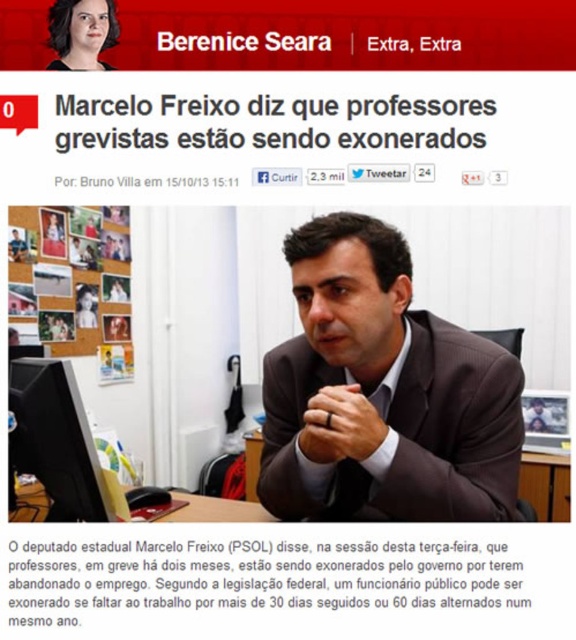
Is brown suit at center further to camera compared to black glossy monitor at lower left?

No, brown suit at center is in front of black glossy monitor at lower left.

What do you see at coordinates (382, 394) in the screenshot?
I see `brown suit at center` at bounding box center [382, 394].

Identify the location of brown suit at center. Image resolution: width=576 pixels, height=640 pixels. (382, 394).

Is brown suit at center bigger than black paper text at center?

Yes.

I want to click on brown suit at center, so click(382, 394).

Does brown suit at center have a greater height compared to matte black hair at upper left?

Indeed, brown suit at center has a greater height compared to matte black hair at upper left.

Can you confirm if brown suit at center is thinner than matte black hair at upper left?

No.

Is point (259, 492) positioned in front of point (72, 1)?

Yes, point (259, 492) is closer to viewer.

Find the location of a particular element. The height and width of the screenshot is (640, 576). brown suit at center is located at coordinates (382, 394).